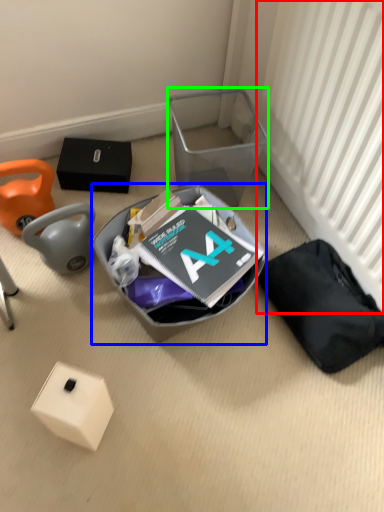
Question: Considering the real-world distances, which object is closest to radiator (highlighted by a red box)? waste (highlighted by a blue box) or shoe box (highlighted by a green box).

Choices:
 (A) waste
 (B) shoe box

Answer: (B)